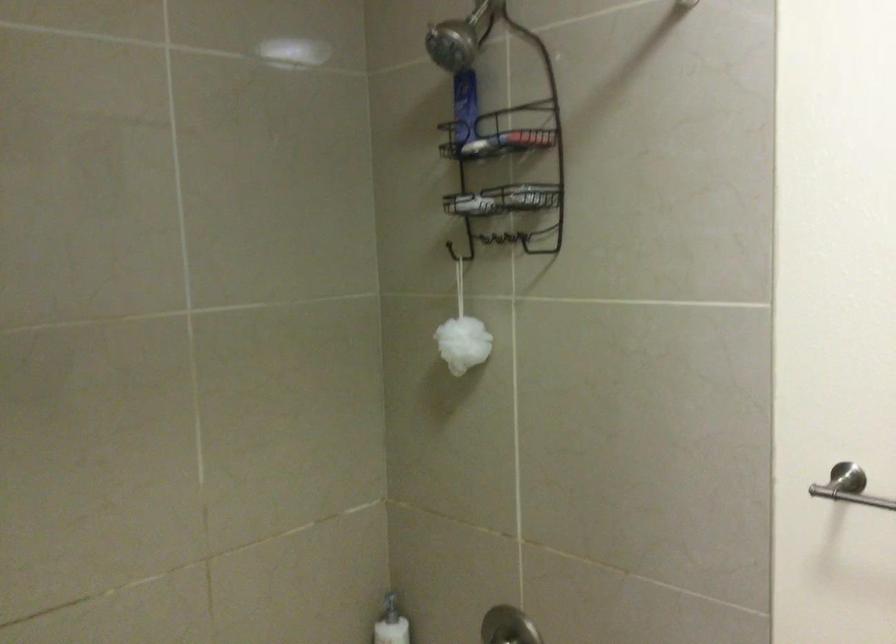
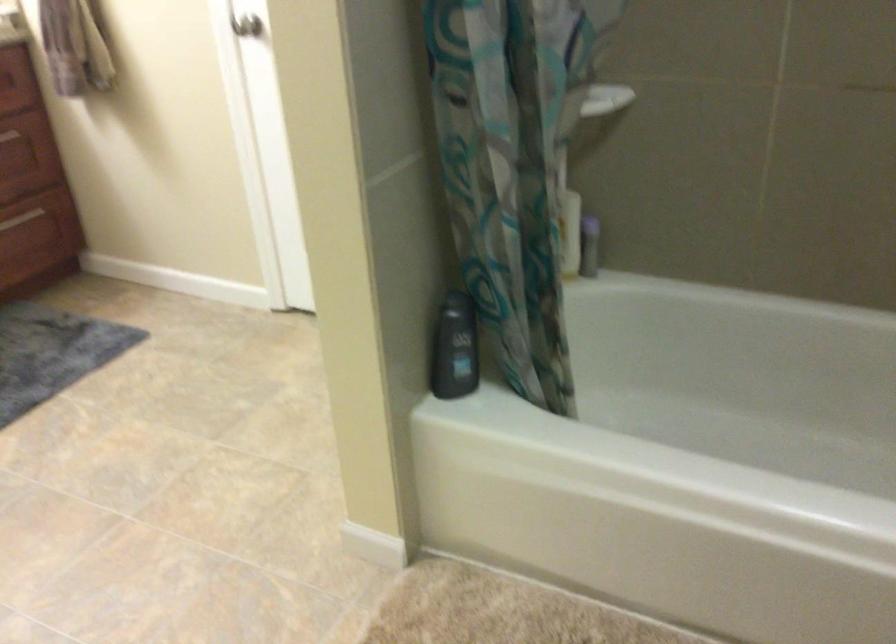
The images are taken continuously from a first-person perspective. In which direction is your viewpoint rotating?

The camera rotated toward left-down.